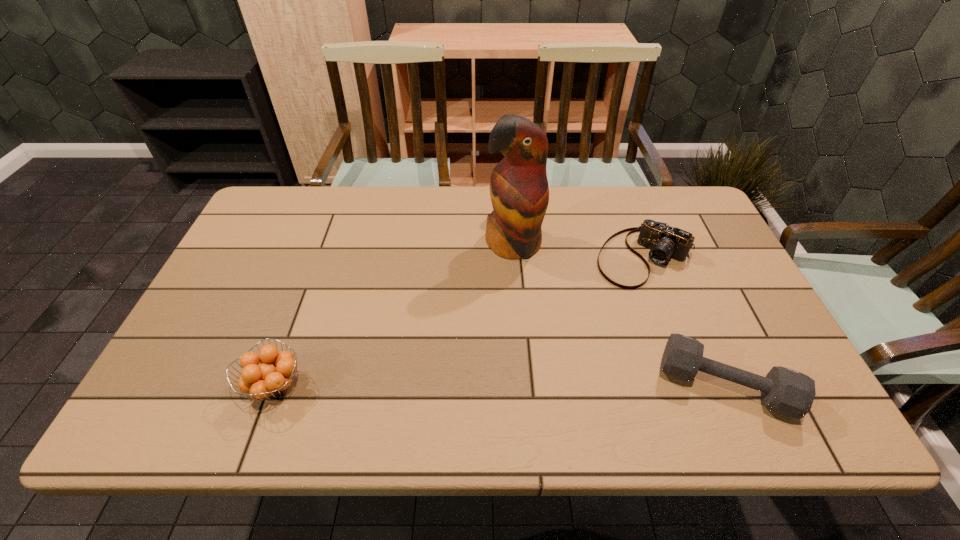
The image size is (960, 540). I want to click on vacant spot on the desktop that is between the leftmost object and the dumbbell and is positioned on the face of the third object from right to left, so click(x=546, y=385).

You are a GUI agent. You are given a task and a screenshot of the screen. Output one action in this format:
    pyautogui.click(x=<x>, y=<y>)
    Task: Click on the free spot on the desktop that is between the leftmost object and the dumbbell and is positioned on the front-facing side of the camera
    This screenshot has width=960, height=540.
    Given the screenshot: What is the action you would take?
    pyautogui.click(x=554, y=385)